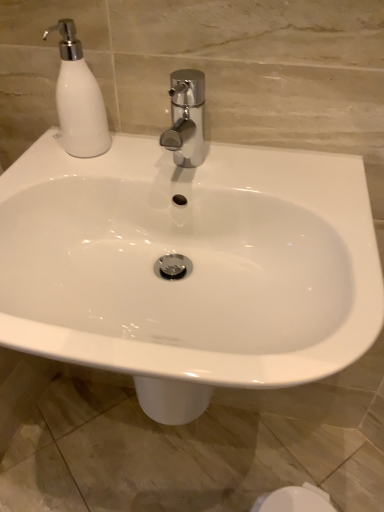
This screenshot has width=384, height=512. In order to click on free space in front of white glossy soap dispenser at upper left in this screenshot , I will do `click(66, 174)`.